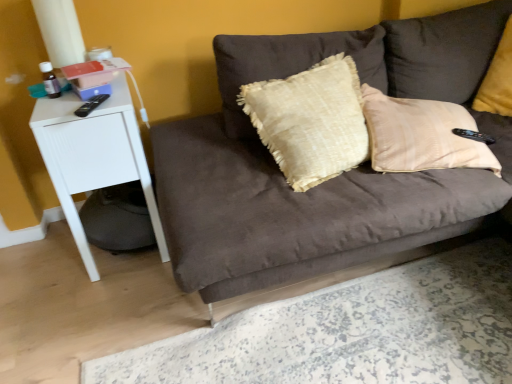
The height and width of the screenshot is (384, 512). What do you see at coordinates (93, 156) in the screenshot?
I see `white matte side table at left` at bounding box center [93, 156].

Where is `suede brown couch at center`? suede brown couch at center is located at coordinates (331, 179).

Locate an element on the screen. The image size is (512, 384). velvet yellow pillow at upper right is located at coordinates (498, 79).

In the image, is white matte side table at left positioned in front of or behind velvet yellow pillow at upper right?

white matte side table at left is positioned closer to the viewer than velvet yellow pillow at upper right.

Measure the distance from white matte side table at left to velvet yellow pillow at upper right.

white matte side table at left and velvet yellow pillow at upper right are 4.98 feet apart.

From a real-world perspective, is white matte side table at left positioned above or below velvet yellow pillow at upper right?

white matte side table at left is situated lower than velvet yellow pillow at upper right in the real world.

Is white matte side table at left at the back of velvet yellow pillow at upper right?

velvet yellow pillow at upper right does not have its back to white matte side table at left.

Does velvet yellow pillow at upper right have a greater height compared to white matte side table at left?

No, velvet yellow pillow at upper right is not taller than white matte side table at left.

Identify the location of pillow that appears above the white matte side table at left (from a real-world perspective). The width and height of the screenshot is (512, 384). (498, 79).

Between velvet yellow pillow at upper right and white matte side table at left, which one has smaller width?

velvet yellow pillow at upper right is thinner.

Find the location of a particular element. pillow above the suede brown couch at center (from a real-world perspective) is located at coordinates (498, 79).

Considering the positions of objects velvet yellow pillow at upper right and suede brown couch at center in the image provided, who is behind, velvet yellow pillow at upper right or suede brown couch at center?

velvet yellow pillow at upper right is further from the camera.

Is velvet yellow pillow at upper right to the left of suede brown couch at center from the viewer's perspective?

In fact, velvet yellow pillow at upper right is to the right of suede brown couch at center.

From a real-world perspective, is velvet yellow pillow at upper right on suede brown couch at center?

Correct, in the physical world, velvet yellow pillow at upper right is higher than suede brown couch at center.

Which object is wider, suede brown couch at center or white matte side table at left?

suede brown couch at center.

From a real-world perspective, which is physically below, suede brown couch at center or white matte side table at left?

white matte side table at left, from a real-world perspective.

Image resolution: width=512 pixels, height=384 pixels. In order to click on studio couch on the right side of white matte side table at left in this screenshot , I will do `click(331, 179)`.

Which is more to the left, suede brown couch at center or white matte side table at left?

Positioned to the left is white matte side table at left.

From a real-world perspective, is suede brown couch at center beneath velvet yellow pillow at upper right?

Yes, from a real-world perspective, suede brown couch at center is below velvet yellow pillow at upper right.

Would you say suede brown couch at center is inside or outside velvet yellow pillow at upper right?

suede brown couch at center cannot be found inside velvet yellow pillow at upper right.

Between suede brown couch at center and velvet yellow pillow at upper right, which one appears on the right side from the viewer's perspective?

velvet yellow pillow at upper right is more to the right.

Looking at this image, can you confirm if suede brown couch at center is wider than velvet yellow pillow at upper right?

Yes, suede brown couch at center is wider than velvet yellow pillow at upper right.

Considering the relative sizes of white matte side table at left and suede brown couch at center in the image provided, is white matte side table at left smaller than suede brown couch at center?

Yes, white matte side table at left is smaller than suede brown couch at center.

I want to click on studio couch on the right side of white matte side table at left, so click(x=331, y=179).

Which object is thinner, white matte side table at left or suede brown couch at center?

With smaller width is white matte side table at left.

Is white matte side table at left at the right side of suede brown couch at center?

Incorrect, white matte side table at left is not on the right side of suede brown couch at center.

Locate an element on the screen. The width and height of the screenshot is (512, 384). table in front of the velvet yellow pillow at upper right is located at coordinates (93, 156).

In the image, there is a velvet yellow pillow at upper right. At what (x,y) coordinates should I click in order to perform the action: click on table below it (from a real-world perspective). Please return your answer as a coordinate pair (x, y). Image resolution: width=512 pixels, height=384 pixels. Looking at the image, I should click on (93, 156).

Based on the photo, based on their spatial positions, is velvet yellow pillow at upper right or suede brown couch at center further from white matte side table at left?

velvet yellow pillow at upper right.

Based on their spatial positions, is suede brown couch at center or velvet yellow pillow at upper right further from white matte side table at left?

Among the two, velvet yellow pillow at upper right is located further to white matte side table at left.

Which object lies further to the anchor point suede brown couch at center, white matte side table at left or velvet yellow pillow at upper right?

velvet yellow pillow at upper right.

Based on their spatial positions, is white matte side table at left or suede brown couch at center closer to velvet yellow pillow at upper right?

Among the two, suede brown couch at center is located nearer to velvet yellow pillow at upper right.

Looking at the image, which one is located closer to velvet yellow pillow at upper right, suede brown couch at center or white matte side table at left?

suede brown couch at center is positioned closer to the anchor velvet yellow pillow at upper right.

From the image, which object appears to be farther from suede brown couch at center, velvet yellow pillow at upper right or white matte side table at left?

velvet yellow pillow at upper right lies further to suede brown couch at center than the other object.

You are a GUI agent. You are given a task and a screenshot of the screen. Output one action in this format:
    pyautogui.click(x=<x>, y=<y>)
    Task: Click on the studio couch located between white matte side table at left and velvet yellow pillow at upper right in the left-right direction
    The image size is (512, 384).
    Given the screenshot: What is the action you would take?
    pyautogui.click(x=331, y=179)